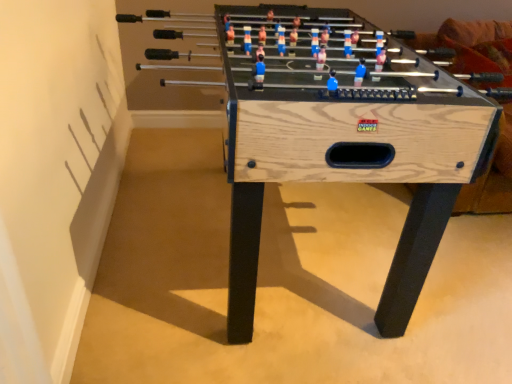
Identify the location of natural wood foosball table at center. This screenshot has height=384, width=512. (346, 148).

This screenshot has width=512, height=384. Describe the element at coordinates (346, 148) in the screenshot. I see `natural wood foosball table at center` at that location.

Locate an element on the screen. The width and height of the screenshot is (512, 384). natural wood foosball table at center is located at coordinates (346, 148).